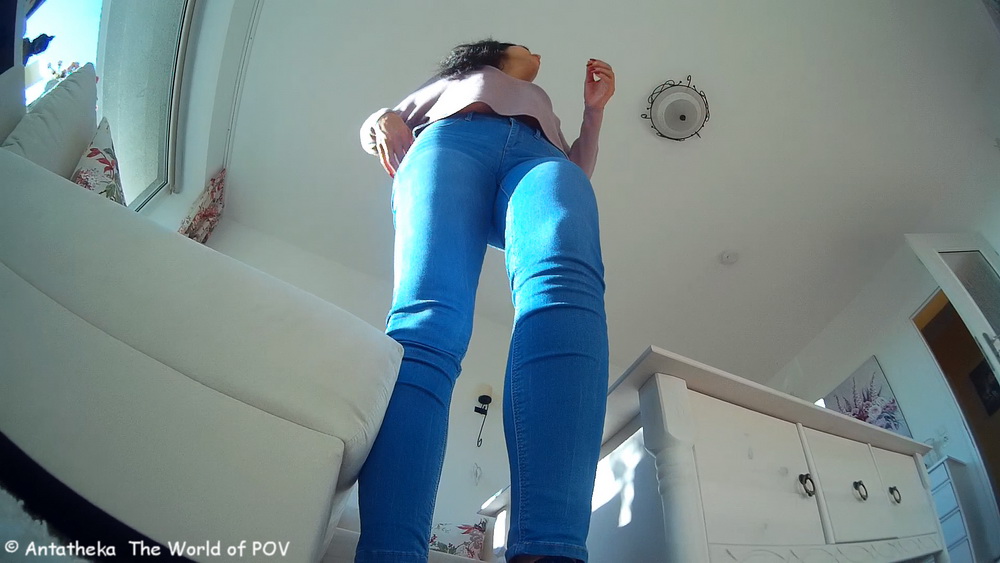
Where is `light fixture`? Image resolution: width=1000 pixels, height=563 pixels. light fixture is located at coordinates [x=678, y=107].